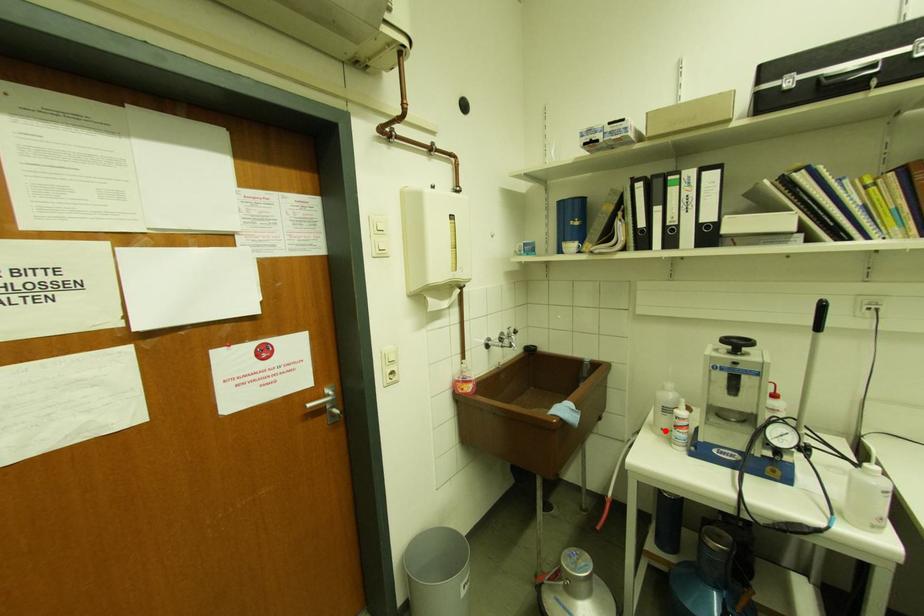
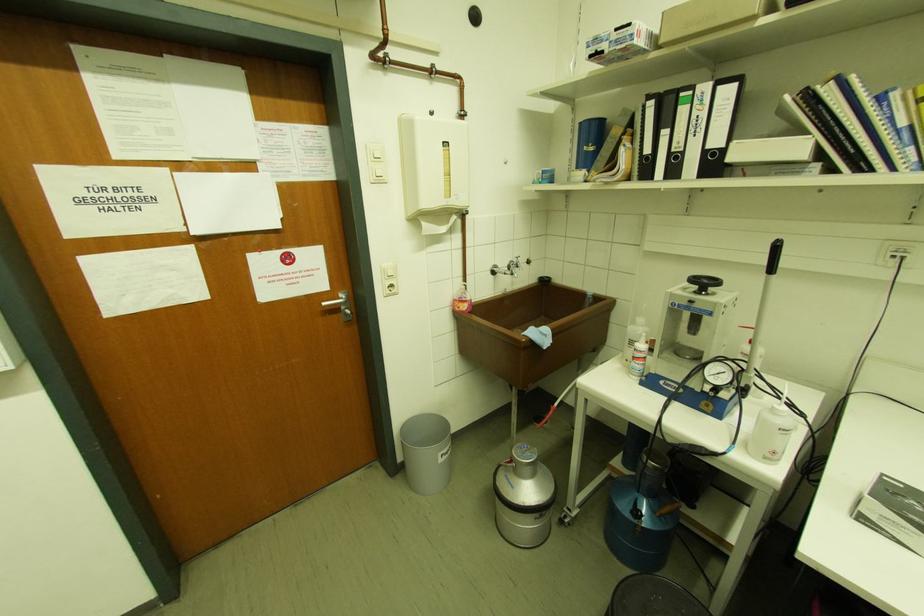
Find the pixel in the second image that matches the highlighted location in the first image.

(629, 362)